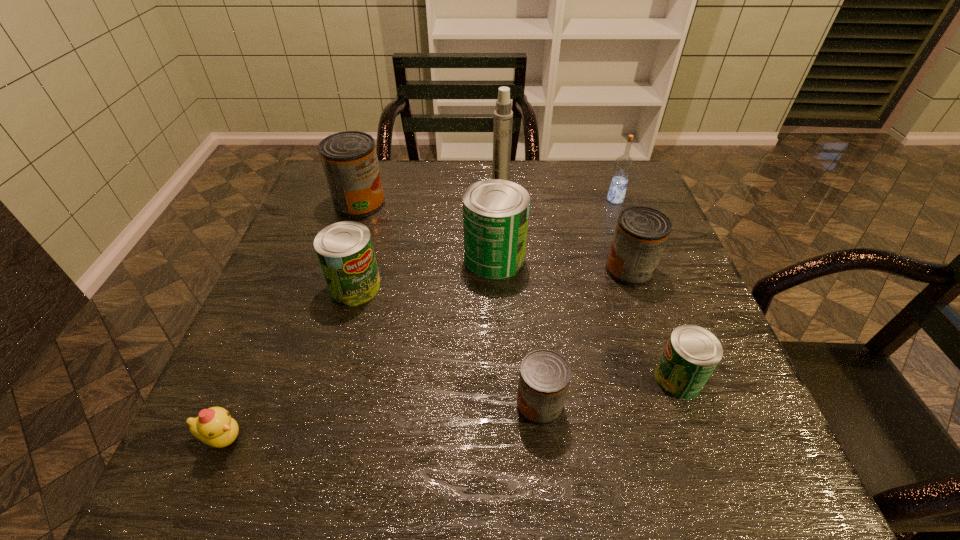
At what (x,y) coordinates should I click in order to perform the action: click on free point between the rightmost green can and the tallest object. Please return your answer as a coordinate pair (x, y). This screenshot has height=540, width=960. Looking at the image, I should click on (589, 284).

Image resolution: width=960 pixels, height=540 pixels. Find the location of `unoccupied position between the biggest green can and the yellow duckling`. unoccupied position between the biggest green can and the yellow duckling is located at coordinates (358, 348).

Image resolution: width=960 pixels, height=540 pixels. Identify the location of unoccupied area between the white aerosol can and the farthest can. (430, 196).

This screenshot has height=540, width=960. In order to click on the eighth closest object to the second smallest green can in this screenshot , I will do `click(623, 166)`.

The width and height of the screenshot is (960, 540). Find the location of `object that is the nearest to the smallest green can`. object that is the nearest to the smallest green can is located at coordinates (544, 377).

Identify which can is the closest to the farthest red can. Please provide its 2D coordinates. Your answer should be formatted as a tuple, i.e. [(x, y)], where the tuple contains the x and y coordinates of a point satisfying the conditions above.

[(344, 249)]

This screenshot has width=960, height=540. I want to click on can that is the third nearest to the leftmost red can, so click(641, 234).

Choose which red can is the second nearest neighbor to the smallest green can. Please provide its 2D coordinates. Your answer should be formatted as a tuple, i.e. [(x, y)], where the tuple contains the x and y coordinates of a point satisfying the conditions above.

[(641, 234)]

Identify which red can is located as the third nearest to the second green can from left to right. Please provide its 2D coordinates. Your answer should be formatted as a tuple, i.e. [(x, y)], where the tuple contains the x and y coordinates of a point satisfying the conditions above.

[(544, 377)]

What are the coordinates of `green can that is the second closest to the biggest red can` in the screenshot? It's located at (495, 212).